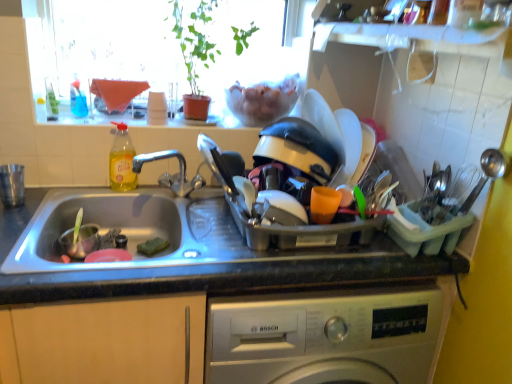
The width and height of the screenshot is (512, 384). What do you see at coordinates (121, 160) in the screenshot?
I see `yellow translucent bottle at sink left` at bounding box center [121, 160].

Where is `yellow translucent bottle at sink left`? Image resolution: width=512 pixels, height=384 pixels. yellow translucent bottle at sink left is located at coordinates (121, 160).

Describe the element at coordinates (12, 185) in the screenshot. I see `brushed metal cup at left, placed as the second appliance when sorted from right to left` at that location.

You are a GUI agent. You are given a task and a screenshot of the screen. Output one action in this format:
    pyautogui.click(x=<x>, y=<y>)
    Task: Click on the yellow translucent bottle at sink left
    Image resolution: width=512 pixels, height=384 pixels.
    Given the screenshot: What is the action you would take?
    pyautogui.click(x=121, y=160)

Does point (128, 101) lie in front of point (12, 186)?

No, it is not.

Can you confirm if transparent glass window at upper center is taller than brushed metal cup at left, placed as the second appliance when sorted from right to left?

Yes, transparent glass window at upper center is taller than brushed metal cup at left, placed as the second appliance when sorted from right to left.

Could you tell me if transparent glass window at upper center is turned towards brushed metal cup at left, placed as the second appliance when sorted from right to left?

No, transparent glass window at upper center is not turned towards brushed metal cup at left, placed as the second appliance when sorted from right to left.

Is the depth of granite gray countertop at center less than that of clear glass window sill at upper center?

Yes, it is in front of clear glass window sill at upper center.

Considering the relative sizes of granite gray countertop at center and clear glass window sill at upper center in the image provided, is granite gray countertop at center smaller than clear glass window sill at upper center?

Incorrect, granite gray countertop at center is not smaller in size than clear glass window sill at upper center.

Would you say granite gray countertop at center is to the left or to the right of clear glass window sill at upper center in the picture?

From the image, it's evident that granite gray countertop at center is to the right of clear glass window sill at upper center.

Locate an element on the screen. This screenshot has height=384, width=512. window sill located above the granite gray countertop at center (from a real-world perspective) is located at coordinates (103, 115).

Who is bigger, clear glass window sill at upper center or metallic silver dish rack at center, which is the 2th appliance in left-to-right order?

metallic silver dish rack at center, which is the 2th appliance in left-to-right order.

Looking at this image, from the image's perspective, is clear glass window sill at upper center below metallic silver dish rack at center, which is the 2th appliance in left-to-right order?

Incorrect, from the image's perspective, clear glass window sill at upper center is higher than metallic silver dish rack at center, which is the 2th appliance in left-to-right order.

Is clear glass window sill at upper center not near metallic silver dish rack at center, acting as the 1th appliance starting from the right?

No.

Is point (207, 124) in front of point (362, 225)?

That is False.

Is clear glass window sill at upper center with yellow translucent bottle at sink left?

They are not placed beside each other.

How distant is clear glass window sill at upper center from yellow translucent bottle at sink left?

clear glass window sill at upper center is 5.56 inches from yellow translucent bottle at sink left.

Is clear glass window sill at upper center inside the boundaries of yellow translucent bottle at sink left, or outside?

clear glass window sill at upper center cannot be found inside yellow translucent bottle at sink left.

Considering the positions of objects clear glass window sill at upper center and yellow translucent bottle at sink left in the image provided, who is more to the left, clear glass window sill at upper center or yellow translucent bottle at sink left?

From the viewer's perspective, yellow translucent bottle at sink left appears more on the left side.

From the image's perspective, between metallic silver dish rack at center, acting as the 1th appliance starting from the right, and granite gray countertop at center, who is located below?

From the image's view, granite gray countertop at center is below.

Consider the image. From a real-world perspective, which is physically above, metallic silver dish rack at center, which is the 2th appliance in left-to-right order, or granite gray countertop at center?

metallic silver dish rack at center, which is the 2th appliance in left-to-right order, from a real-world perspective.

Is the depth of metallic silver dish rack at center, acting as the 1th appliance starting from the right, less than that of granite gray countertop at center?

Yes, metallic silver dish rack at center, acting as the 1th appliance starting from the right, is in front of granite gray countertop at center.

Is brushed metal cup at left, acting as the first appliance starting from the left, not near yellow translucent bottle at sink left?

They are positioned close to each other.

From a real-world perspective, who is located lower, brushed metal cup at left, acting as the first appliance starting from the left, or yellow translucent bottle at sink left?

From a 3D spatial view, brushed metal cup at left, acting as the first appliance starting from the left, is below.

Is brushed metal cup at left, placed as the second appliance when sorted from right to left, oriented towards yellow translucent bottle at sink left?

No.

Considering the sizes of brushed metal cup at left, acting as the first appliance starting from the left, and yellow translucent bottle at sink left in the image, is brushed metal cup at left, acting as the first appliance starting from the left, bigger or smaller than yellow translucent bottle at sink left?

Considering their sizes, brushed metal cup at left, acting as the first appliance starting from the left, takes up less space than yellow translucent bottle at sink left.

Does brushed metal cup at left, acting as the first appliance starting from the left, come in front of metallic silver dish rack at center, which is the 2th appliance in left-to-right order?

No, brushed metal cup at left, acting as the first appliance starting from the left, is further to the viewer.

From a real-world perspective, is brushed metal cup at left, placed as the second appliance when sorted from right to left, physically above metallic silver dish rack at center, acting as the 1th appliance starting from the right?

No, from a real-world perspective, brushed metal cup at left, placed as the second appliance when sorted from right to left, is not above metallic silver dish rack at center, acting as the 1th appliance starting from the right.

How many degrees apart are the facing directions of brushed metal cup at left, placed as the second appliance when sorted from right to left, and metallic silver dish rack at center, acting as the 1th appliance starting from the right?

20.1 degrees.

Considering the relative sizes of brushed metal cup at left, placed as the second appliance when sorted from right to left, and metallic silver dish rack at center, which is the 2th appliance in left-to-right order, in the image provided, is brushed metal cup at left, placed as the second appliance when sorted from right to left, smaller than metallic silver dish rack at center, which is the 2th appliance in left-to-right order,?

Indeed, brushed metal cup at left, placed as the second appliance when sorted from right to left, has a smaller size compared to metallic silver dish rack at center, which is the 2th appliance in left-to-right order.

Where is `the 1st appliance in front of the transparent glass window at upper center, starting your count from the anchor`? the 1st appliance in front of the transparent glass window at upper center, starting your count from the anchor is located at coordinates (12, 185).

Image resolution: width=512 pixels, height=384 pixels. What are the coordinates of `countertop on the right of clear glass window sill at upper center` in the screenshot? It's located at (214, 302).

Which object lies nearer to the anchor point granite gray countertop at center, yellow translucent bottle at sink left or transparent glass window at upper center?

Based on the image, yellow translucent bottle at sink left appears to be nearer to granite gray countertop at center.

Considering their positions, is yellow translucent bottle at sink left positioned closer to clear glass window sill at upper center than granite gray countertop at center?

Among the two, yellow translucent bottle at sink left is located nearer to clear glass window sill at upper center.

Based on the photo, from the image, which object appears to be nearer to granite gray countertop at center, brushed metal cup at left, placed as the second appliance when sorted from right to left, or yellow translucent bottle at sink left?

yellow translucent bottle at sink left is closer to granite gray countertop at center.

When comparing their distances from metallic silver dish rack at center, which is the 2th appliance in left-to-right order, does transparent glass window at upper center or clear glass window sill at upper center seem closer?

The object closer to metallic silver dish rack at center, which is the 2th appliance in left-to-right order, is transparent glass window at upper center.

Considering their positions, is transparent glass window at upper center positioned further to yellow translucent bottle at sink left than metallic silver dish rack at center, which is the 2th appliance in left-to-right order?

The object further to yellow translucent bottle at sink left is metallic silver dish rack at center, which is the 2th appliance in left-to-right order.

Looking at the image, which one is located closer to brushed metal cup at left, acting as the first appliance starting from the left, transparent glass window at upper center or granite gray countertop at center?

transparent glass window at upper center.

Based on their spatial positions, is brushed metal cup at left, acting as the first appliance starting from the left, or yellow translucent bottle at sink left further from metallic silver dish rack at center, which is the 2th appliance in left-to-right order?

The object further to metallic silver dish rack at center, which is the 2th appliance in left-to-right order, is brushed metal cup at left, acting as the first appliance starting from the left.

When comparing their distances from metallic silver dish rack at center, which is the 2th appliance in left-to-right order, does clear glass window sill at upper center or brushed metal cup at left, acting as the first appliance starting from the left, seem closer?

Among the two, clear glass window sill at upper center is located nearer to metallic silver dish rack at center, which is the 2th appliance in left-to-right order.

Locate an element on the screen. This screenshot has height=384, width=512. window sill situated between brushed metal cup at left, acting as the first appliance starting from the left, and metallic silver dish rack at center, acting as the 1th appliance starting from the right, from left to right is located at coordinates (103, 115).

You are a GUI agent. You are given a task and a screenshot of the screen. Output one action in this format:
    pyautogui.click(x=<x>, y=<y>)
    Task: Click on the bottle between brushed metal cup at left, acting as the first appliance starting from the left, and metallic silver dish rack at center, acting as the 1th appliance starting from the right, in the horizontal direction
    The height and width of the screenshot is (384, 512).
    Given the screenshot: What is the action you would take?
    tap(121, 160)

At what (x,y) coordinates should I click in order to perform the action: click on bottle between granite gray countertop at center and clear glass window sill at upper center along the z-axis. Please return your answer as a coordinate pair (x, y). This screenshot has width=512, height=384. Looking at the image, I should click on (121, 160).

Where is `window sill located between yellow translucent bottle at sink left and metallic silver dish rack at center, which is the 2th appliance in left-to-right order, in the left-right direction`? window sill located between yellow translucent bottle at sink left and metallic silver dish rack at center, which is the 2th appliance in left-to-right order, in the left-right direction is located at coordinates (103, 115).